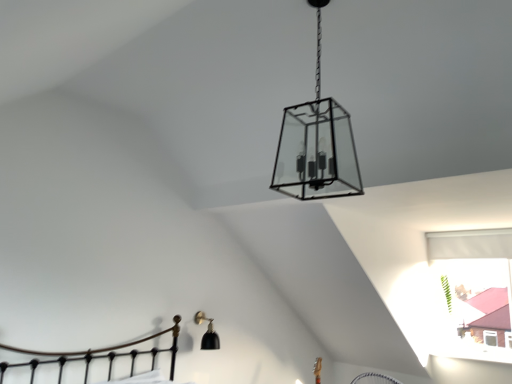
Question: Considering the relative positions of clear glass lantern at center, the 1th lamp in the top-to-bottom sequence, and black matte wall sconce at lower left, the 2th lamp positioned from the top, in the image provided, is clear glass lantern at center, the 1th lamp in the top-to-bottom sequence, to the right of black matte wall sconce at lower left, the 2th lamp positioned from the top, from the viewer's perspective?

Choices:
 (A) yes
 (B) no

Answer: (A)

Question: From the image's perspective, is clear glass lantern at center, placed as the 2th lamp when sorted from bottom to top, on top of black matte wall sconce at lower left, the 2th lamp positioned from the top?

Choices:
 (A) yes
 (B) no

Answer: (A)

Question: Is clear glass lantern at center, acting as the 2th lamp starting from the back, beside black matte wall sconce at lower left, which is the first lamp from back to front?

Choices:
 (A) yes
 (B) no

Answer: (B)

Question: Can you confirm if clear glass lantern at center, the 1th lamp positioned from the right, is wider than black matte wall sconce at lower left, which is the first lamp from back to front?

Choices:
 (A) no
 (B) yes

Answer: (B)

Question: From a real-world perspective, is clear glass lantern at center, acting as the 2th lamp starting from the back, positioned under black matte wall sconce at lower left, which is the 1th lamp in bottom-to-top order, based on gravity?

Choices:
 (A) no
 (B) yes

Answer: (A)

Question: Can we say clear glass lantern at center, the 1th lamp in the top-to-bottom sequence, lies outside black matte wall sconce at lower left, marked as the second lamp in a front-to-back arrangement?

Choices:
 (A) no
 (B) yes

Answer: (B)

Question: From a real-world perspective, is black matte wall sconce at lower left, which is the 1th lamp in bottom-to-top order, located higher than clear glass lantern at center, acting as the 2th lamp starting from the back?

Choices:
 (A) no
 (B) yes

Answer: (A)

Question: Is black matte wall sconce at lower left, marked as the second lamp in a front-to-back arrangement, facing away from clear glass lantern at center, arranged as the 2th lamp when viewed from the left?

Choices:
 (A) no
 (B) yes

Answer: (A)

Question: Considering the relative positions of black matte wall sconce at lower left, the 2th lamp positioned from the top, and clear glass lantern at center, which appears as the 1th lamp when viewed from the front, in the image provided, is black matte wall sconce at lower left, the 2th lamp positioned from the top, to the right of clear glass lantern at center, which appears as the 1th lamp when viewed from the front, from the viewer's perspective?

Choices:
 (A) yes
 (B) no

Answer: (B)

Question: Is black matte wall sconce at lower left, marked as the second lamp in a front-to-back arrangement, far from clear glass lantern at center, acting as the 2th lamp starting from the back?

Choices:
 (A) no
 (B) yes

Answer: (B)

Question: Considering the relative sizes of black matte wall sconce at lower left, the 2th lamp positioned from the top, and clear glass lantern at center, placed as the 2th lamp when sorted from bottom to top, in the image provided, is black matte wall sconce at lower left, the 2th lamp positioned from the top, thinner than clear glass lantern at center, placed as the 2th lamp when sorted from bottom to top,?

Choices:
 (A) no
 (B) yes

Answer: (B)

Question: Does black matte wall sconce at lower left, which is the 1th lamp in bottom-to-top order, have a greater height compared to clear glass lantern at center, the 1th lamp in the top-to-bottom sequence?

Choices:
 (A) yes
 (B) no

Answer: (B)

Question: Would you say clear glass lantern at center, the 1th lamp positioned from the right, is inside or outside black matte wall sconce at lower left, the 2th lamp positioned from the top?

Choices:
 (A) inside
 (B) outside

Answer: (B)